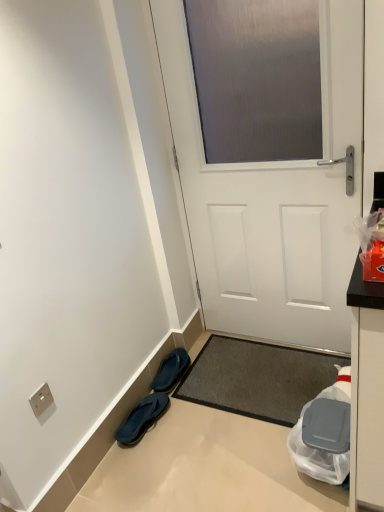
Question: Can you confirm if silver metallic electric outlet at lower left is positioned to the right of blue rubber flip-flops at lower left, which is the 2th footwear in back-to-front order?

Choices:
 (A) yes
 (B) no

Answer: (B)

Question: From a real-world perspective, is silver metallic electric outlet at lower left over blue rubber flip-flops at lower left, the 1th footwear viewed from the front?

Choices:
 (A) no
 (B) yes

Answer: (B)

Question: Could you tell me if silver metallic electric outlet at lower left is facing blue rubber flip-flops at lower left, which is the 2th footwear in back-to-front order?

Choices:
 (A) no
 (B) yes

Answer: (A)

Question: Is silver metallic electric outlet at lower left smaller than blue rubber flip-flops at lower left, which is the 2th footwear in back-to-front order?

Choices:
 (A) yes
 (B) no

Answer: (A)

Question: From the image's perspective, is silver metallic electric outlet at lower left beneath blue rubber flip-flops at lower left, which is the 2th footwear in back-to-front order?

Choices:
 (A) yes
 (B) no

Answer: (B)

Question: Is silver metallic electric outlet at lower left next to blue rubber flip-flops at lower left, the 1th footwear viewed from the front?

Choices:
 (A) no
 (B) yes

Answer: (A)

Question: Does dark gray textured mat at center have a greater height compared to white matte door at center?

Choices:
 (A) yes
 (B) no

Answer: (B)

Question: Is white matte door at center completely or partially inside dark gray textured mat at center?

Choices:
 (A) yes
 (B) no

Answer: (B)

Question: Is dark gray textured mat at center positioned far away from white matte door at center?

Choices:
 (A) yes
 (B) no

Answer: (B)

Question: Is dark gray textured mat at center thinner than white matte door at center?

Choices:
 (A) no
 (B) yes

Answer: (A)

Question: Is dark gray textured mat at center outside white matte door at center?

Choices:
 (A) no
 (B) yes

Answer: (B)

Question: Is dark gray textured mat at center further to camera compared to white matte door at center?

Choices:
 (A) yes
 (B) no

Answer: (A)

Question: Is blue rubber flip-flops at lower left, arranged as the first footwear when viewed from the back, oriented away from dark gray textured mat at center?

Choices:
 (A) yes
 (B) no

Answer: (B)